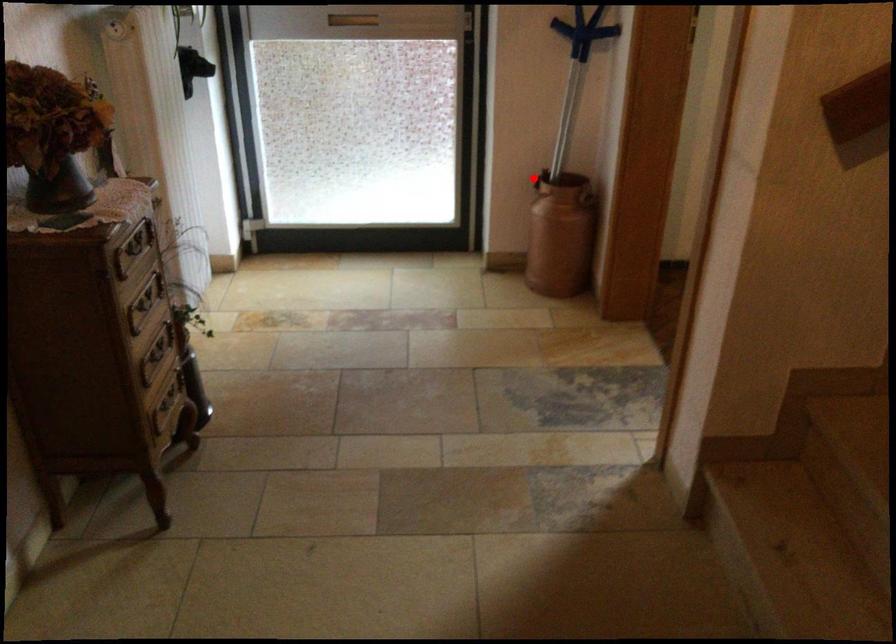
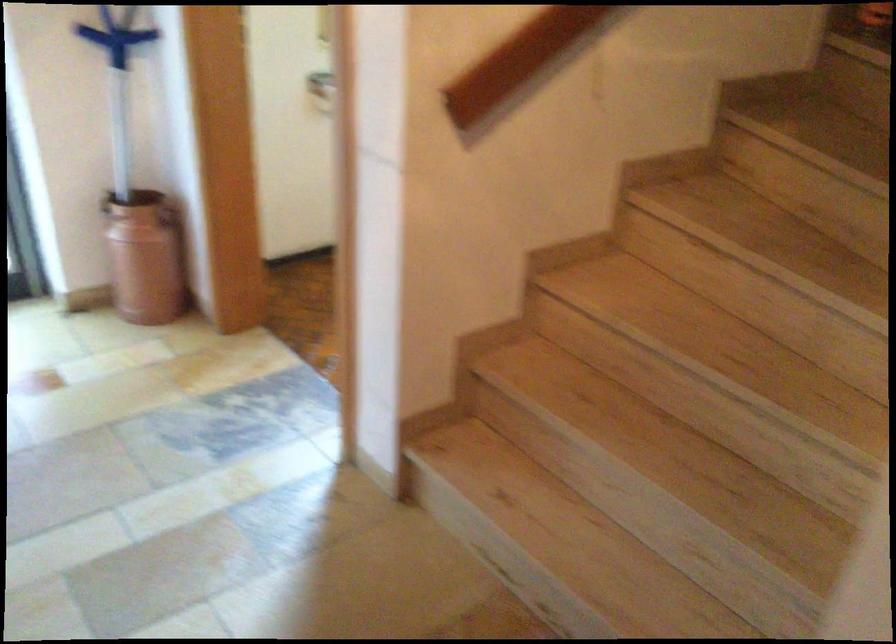
The point at the highlighted location is marked in the first image. Where is the corresponding point in the second image?

(105, 202)